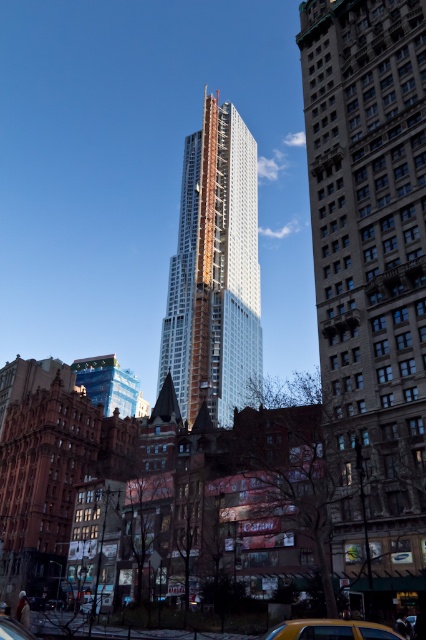
Who is more forward, (x=187, y=371) or (x=386, y=636)?

Point (x=386, y=636) is in front.

Who is more distant from viewer, [164,323] or [382,637]?

Positioned behind is point [164,323].

At what (x,y) coordinates should I click in order to perform the action: click on white glass skyscraper at center. Please return your answer as a coordinate pair (x, y). Looking at the image, I should click on (215, 269).